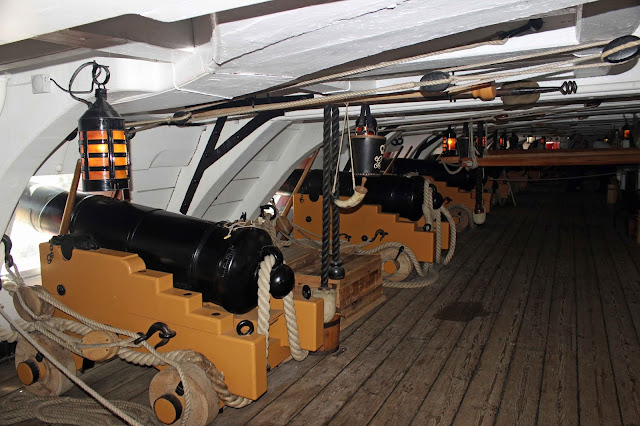
Where is `window`? The height and width of the screenshot is (426, 640). window is located at coordinates (19, 236).